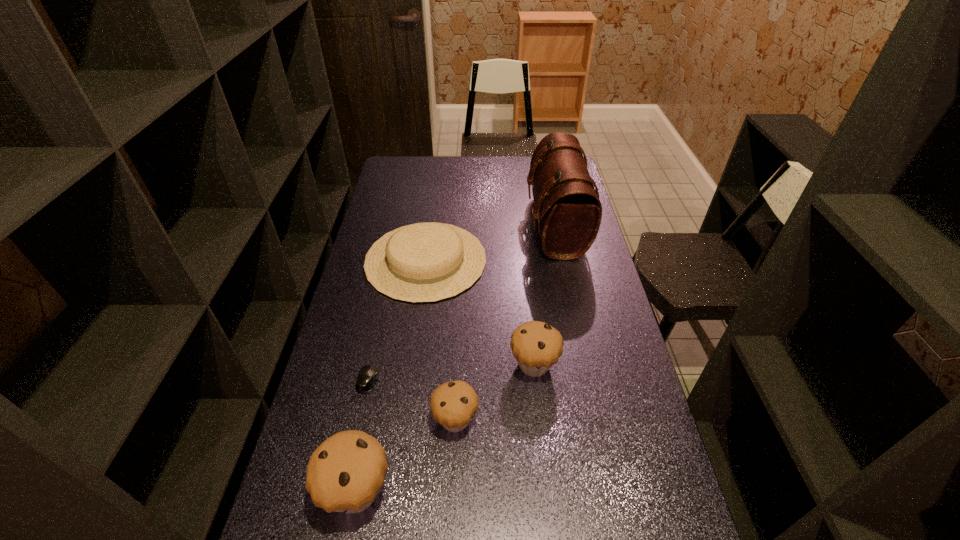
Considering the uniform spacing of muffins, where should an additional muffin be positioned on the right? Please locate a free spot. Please provide its 2D coordinates. Your answer should be formatted as a tuple, i.e. [(x, y)], where the tuple contains the x and y coordinates of a point satisfying the conditions above.

[(598, 319)]